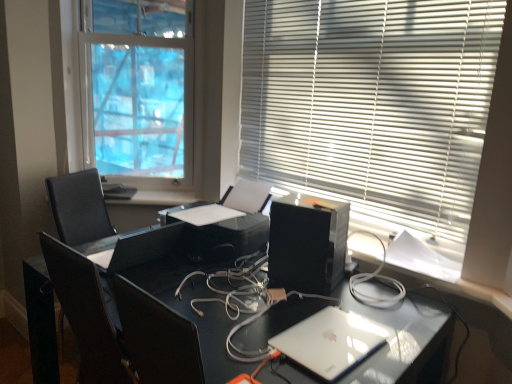
Identify the location of free space behind satin white laptop at lower right. The width and height of the screenshot is (512, 384). (312, 299).